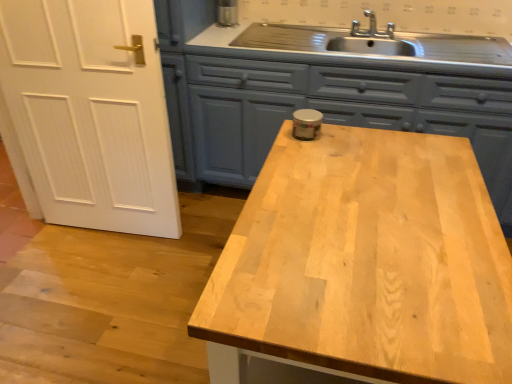
What do you see at coordinates (324, 114) in the screenshot? I see `matte blue cabinetry at center` at bounding box center [324, 114].

At what (x,y) coordinates should I click in order to perform the action: click on matte blue cabinetry at center. Please return your answer as a coordinate pair (x, y). Image resolution: width=512 pixels, height=384 pixels. Looking at the image, I should click on (324, 114).

At what (x,y) coordinates should I click in order to perform the action: click on light wood countertop at center. Please return your answer as a coordinate pair (x, y). This screenshot has height=384, width=512. Looking at the image, I should click on (362, 267).

Image resolution: width=512 pixels, height=384 pixels. Describe the element at coordinates (362, 267) in the screenshot. I see `light wood countertop at center` at that location.

You are a GUI agent. You are given a task and a screenshot of the screen. Output one action in this format:
    pyautogui.click(x=<x>, y=<y>)
    Task: Click on the matte blue cabinetry at center
    The width and height of the screenshot is (512, 384).
    Given the screenshot: What is the action you would take?
    pyautogui.click(x=324, y=114)

Does light wood countertop at center appear on the left side of matte blue cabinetry at center?

Yes.

Which is in front, light wood countertop at center or matte blue cabinetry at center?

light wood countertop at center.

Is point (404, 248) farther from camera compared to point (206, 122)?

No, (404, 248) is in front of (206, 122).

From the image's perspective, is light wood countertop at center located above or below matte blue cabinetry at center?

Based on their image positions, light wood countertop at center is located beneath matte blue cabinetry at center.

From a real-world perspective, is light wood countertop at center under matte blue cabinetry at center?

No, from a real-world perspective, light wood countertop at center is not under matte blue cabinetry at center.

Which object is wider, light wood countertop at center or matte blue cabinetry at center?

matte blue cabinetry at center is wider.

Considering the sizes of objects light wood countertop at center and matte blue cabinetry at center in the image provided, who is shorter, light wood countertop at center or matte blue cabinetry at center?

light wood countertop at center is shorter.

Between light wood countertop at center and matte blue cabinetry at center, which one has larger size?

matte blue cabinetry at center.

Could matte blue cabinetry at center be considered to be inside light wood countertop at center?

No, matte blue cabinetry at center is not surrounded by light wood countertop at center.

Can you see light wood countertop at center touching matte blue cabinetry at center?

No, light wood countertop at center is not touching matte blue cabinetry at center.

Is matte blue cabinetry at center at the back of light wood countertop at center?

light wood countertop at center does not have its back to matte blue cabinetry at center.

What's the angular difference between light wood countertop at center and matte blue cabinetry at center's facing directions?

90.7 degrees.

How distant is light wood countertop at center from matte blue cabinetry at center?

light wood countertop at center is 1.13 meters from matte blue cabinetry at center.

Identify the location of countertop lying on the left of matte blue cabinetry at center. (362, 267).

In the image, is matte blue cabinetry at center on the left side or the right side of light wood countertop at center?

Clearly, matte blue cabinetry at center is on the right of light wood countertop at center in the image.

Which object is further away from the camera taking this photo, matte blue cabinetry at center or light wood countertop at center?

matte blue cabinetry at center is more distant.

Is point (249, 116) positioned in front of point (260, 298)?

That is False.

From the image's perspective, is matte blue cabinetry at center beneath light wood countertop at center?

No, from the image's perspective, matte blue cabinetry at center is not beneath light wood countertop at center.

From a real-world perspective, is matte blue cabinetry at center below light wood countertop at center?

Yes, from a real-world perspective, matte blue cabinetry at center is beneath light wood countertop at center.

Is matte blue cabinetry at center wider than light wood countertop at center?

Yes, matte blue cabinetry at center is wider than light wood countertop at center.

Can you confirm if matte blue cabinetry at center is shorter than light wood countertop at center?

In fact, matte blue cabinetry at center may be taller than light wood countertop at center.

Between matte blue cabinetry at center and light wood countertop at center, which one has larger size?

matte blue cabinetry at center is bigger.

Is matte blue cabinetry at center not inside light wood countertop at center?

Absolutely, matte blue cabinetry at center is external to light wood countertop at center.

Is there a large distance between matte blue cabinetry at center and light wood countertop at center?

Indeed, matte blue cabinetry at center is not near light wood countertop at center.

Is matte blue cabinetry at center turned away from light wood countertop at center?

No, matte blue cabinetry at center is not facing the opposite direction of light wood countertop at center.

In order to click on countertop on the left of matte blue cabinetry at center in this screenshot , I will do `click(362, 267)`.

Image resolution: width=512 pixels, height=384 pixels. In order to click on countertop lying in front of the matte blue cabinetry at center in this screenshot , I will do `click(362, 267)`.

Where is `cabinetry behind the light wood countertop at center`? The image size is (512, 384). cabinetry behind the light wood countertop at center is located at coordinates (324, 114).